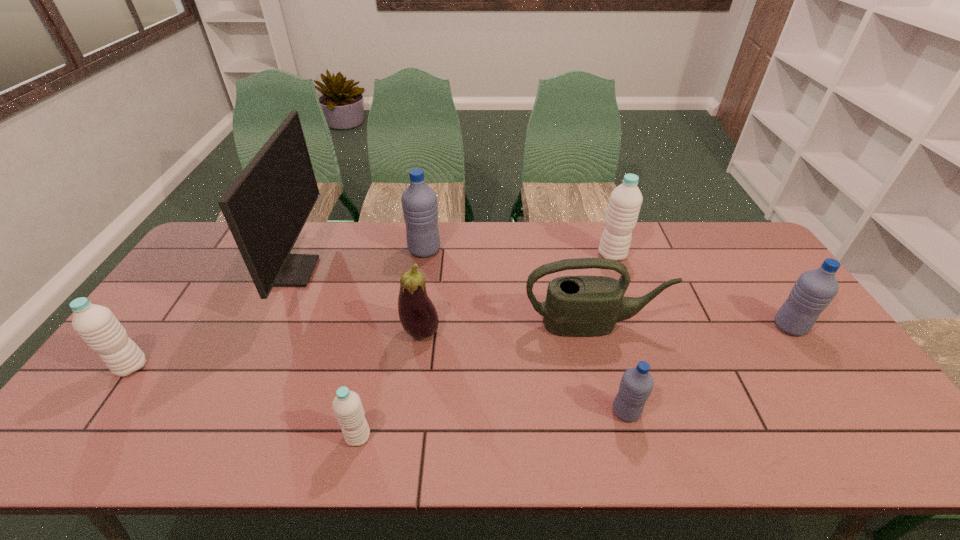
At what (x,y) coordinates should I click in order to perform the action: click on the third nearest object. Please return your answer as a coordinate pair (x, y). Looking at the image, I should click on (96, 325).

The width and height of the screenshot is (960, 540). Identify the location of the second farthest white water bottle. (96, 325).

Where is `the nearest blue water bottle`? This screenshot has height=540, width=960. the nearest blue water bottle is located at coordinates (636, 384).

I want to click on the second blue water bottle from right to left, so click(x=636, y=384).

Where is `the nearest object`? This screenshot has width=960, height=540. the nearest object is located at coordinates (347, 406).

You are a GUI agent. You are given a task and a screenshot of the screen. Output one action in this format:
    pyautogui.click(x=<x>, y=<y>)
    Task: Click on the second water bottle from left to right
    This screenshot has width=960, height=540.
    Given the screenshot: What is the action you would take?
    click(x=347, y=406)

The width and height of the screenshot is (960, 540). I want to click on free spot located 0.060m on the front-facing side of the tallest object, so click(332, 272).

Where is `vacant region located 0.060m on the front of the fourth water bottle from right to left`? This screenshot has width=960, height=540. vacant region located 0.060m on the front of the fourth water bottle from right to left is located at coordinates (421, 272).

Identify the location of vacant space located on the front of the biggest white water bottle. The image size is (960, 540). (619, 275).

Identify the location of free space located 0.290m on the front of the eggplant. This screenshot has width=960, height=540. pyautogui.click(x=406, y=447).